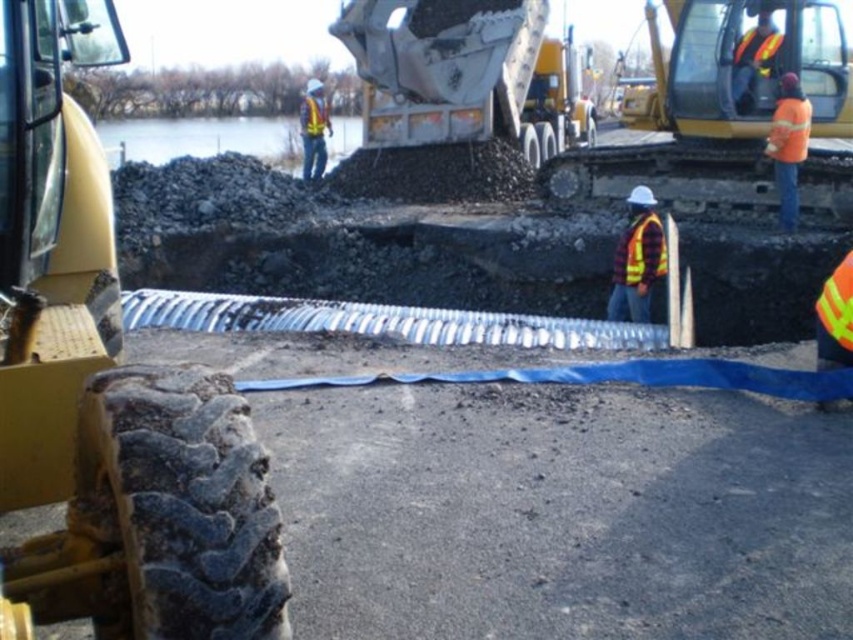
You are a safety inspector standing at the entrance of the construction site. You need to check the orange reflective safety vest at upper right. Can you see it clearly from your position 15 meters away?

The orange reflective safety vest at upper right is 10.76 meters away from the viewer, so yes, you can see it clearly from 15 meters away as it is within the visible range.

You are a safety inspector at the construction site. You notice the black gravel at center and the orange reflective safety vest at upper right. Which object would you estimate to be larger in size?

The black gravel at center is bigger than orange reflective safety vest at upper right.

You are a safety inspector on the construction site. You notice two safety vests in the image. Which one, the orange reflective safety vest at upper right or the yellow reflective safety vest at center, is closer to you?

The orange reflective safety vest at upper right is closer to you because it is in front of the yellow reflective safety vest at center.